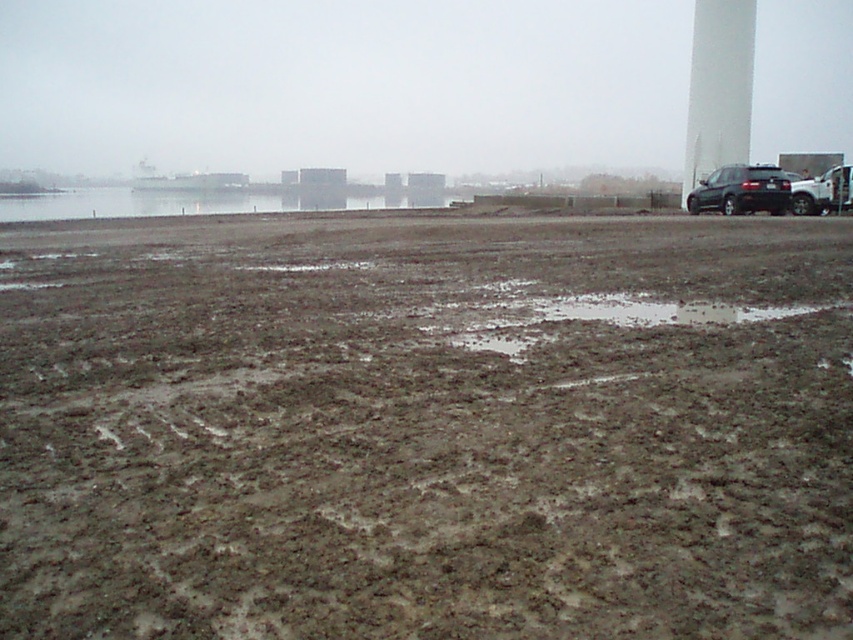
Question: Does muddy wet puddle at center have a smaller size compared to black matte suv at right?

Choices:
 (A) yes
 (B) no

Answer: (B)

Question: Estimate the real-world distances between objects in this image. Which object is farther from the dull brown dirt at center?

Choices:
 (A) black matte truck at right
 (B) gray concrete flood at lower left
 (C) white smooth water tower at upper right
 (D) muddy wet puddle at center

Answer: (B)

Question: Which of the following is the farthest from the observer?

Choices:
 (A) black matte suv at right
 (B) black matte truck at right

Answer: (B)

Question: Which object is positioned farthest from the dull brown dirt at center?

Choices:
 (A) black matte truck at right
 (B) muddy wet puddle at center

Answer: (A)

Question: Can you confirm if dull brown dirt at center is positioned to the right of black matte suv at right?

Choices:
 (A) no
 (B) yes

Answer: (A)

Question: Can you confirm if gray concrete flood at lower left is positioned below black matte truck at right?

Choices:
 (A) no
 (B) yes

Answer: (A)